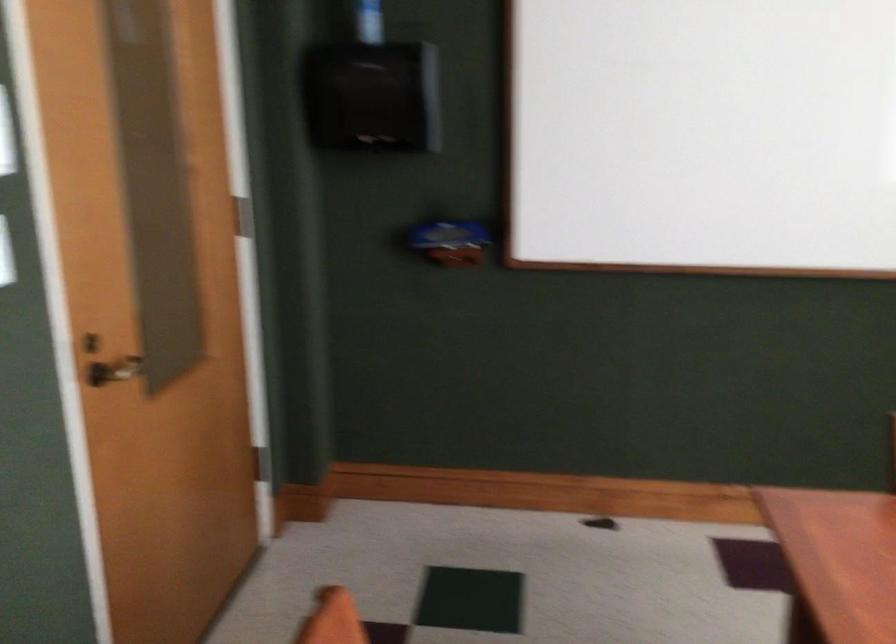
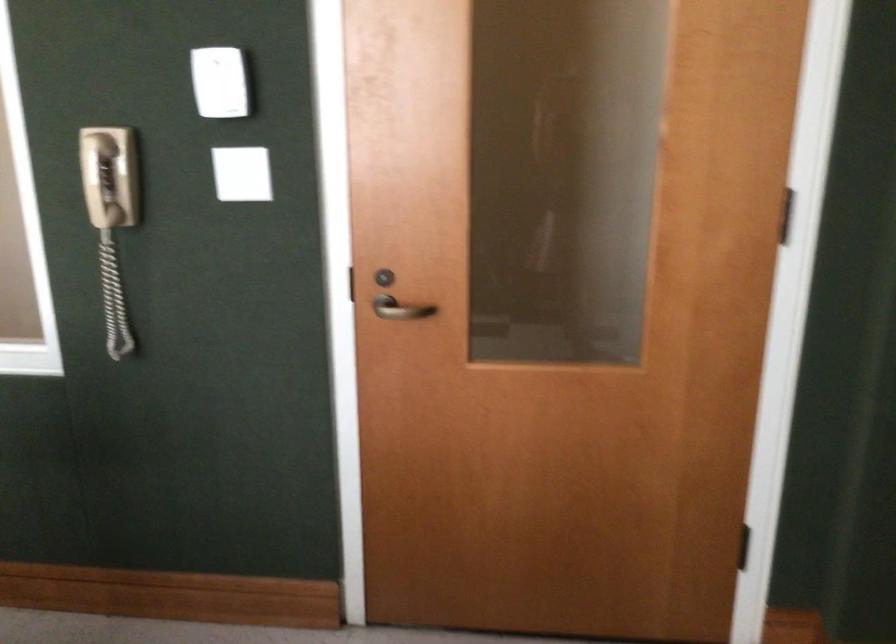
Where in the second image is the point corresponding to (70,371) from the first image?

(346, 283)